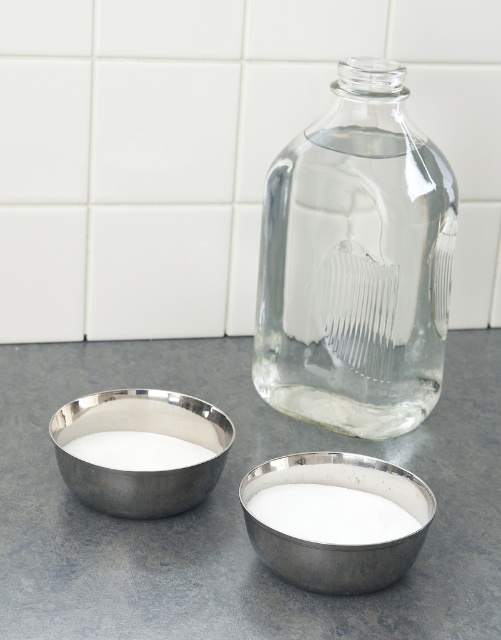
Who is lower down, metallic bowls at center or clear glass jar at center?

Positioned lower is metallic bowls at center.

Is metallic bowls at center shorter than clear glass jar at center?

Correct, metallic bowls at center is not as tall as clear glass jar at center.

Who is more forward, (268, 449) or (412, 394)?

Point (268, 449)

Where is `metallic bowls at center`? This screenshot has width=501, height=640. metallic bowls at center is located at coordinates (236, 508).

Is point (147, 412) positioned in front of point (303, 579)?

No, (147, 412) is behind (303, 579).

Who is higher up, silver metallic bowl at lower left or silver metallic bowl at lower center?

silver metallic bowl at lower left is higher up.

Is point (142, 472) farther from viewer compared to point (260, 467)?

No, (142, 472) is in front of (260, 467).

Find the location of a particular element. This screenshot has height=640, width=501. silver metallic bowl at lower left is located at coordinates (146, 429).

In the scene shown: Who is positioned more to the left, silver metallic bowl at lower left or white powdery substance at lower center?

silver metallic bowl at lower left is more to the left.

Between point (121, 497) and point (366, 500), which one is positioned behind?

The point (366, 500) is behind.

Locate an element on the screen. The width and height of the screenshot is (501, 640). silver metallic bowl at lower left is located at coordinates (146, 429).